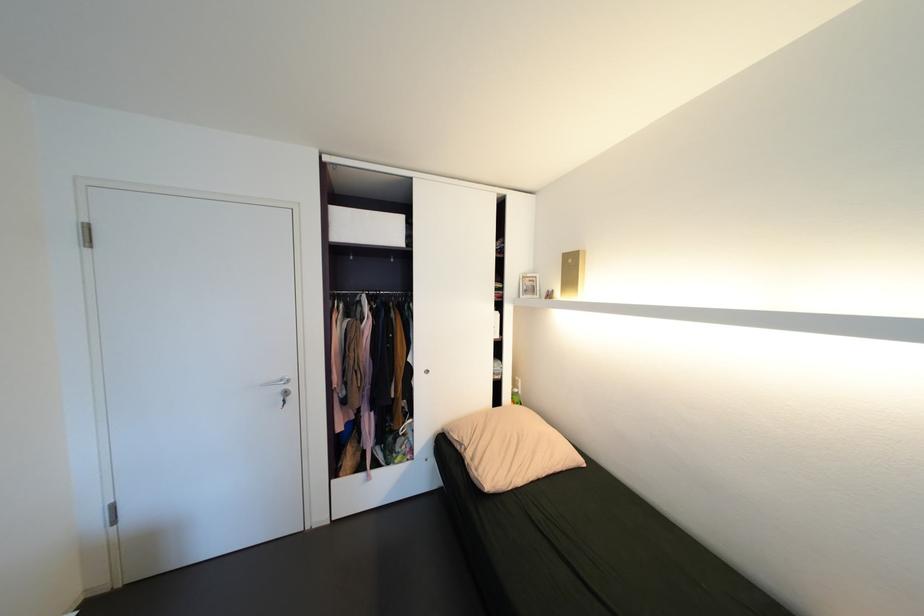
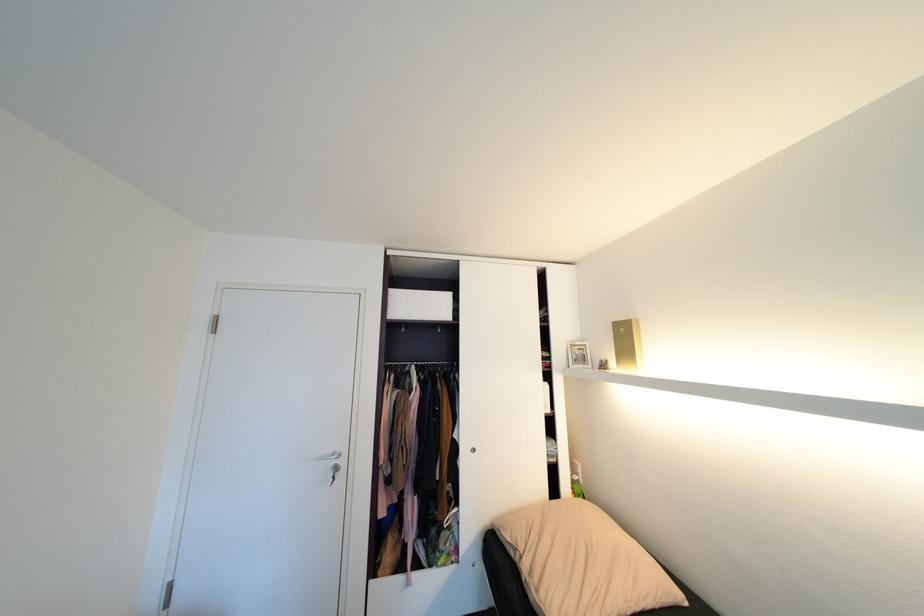
Find the pixel in the second image that matches the point at 434,371 in the first image.

(481, 450)